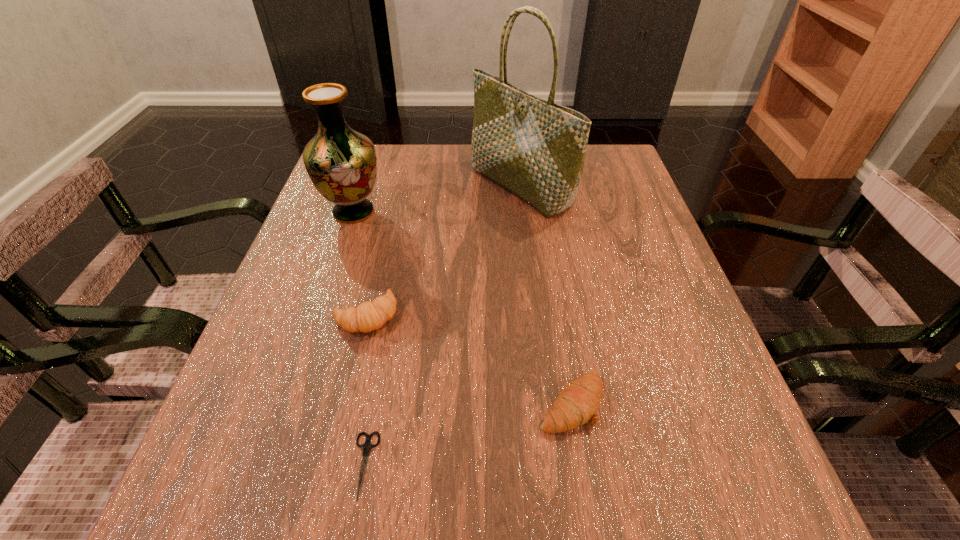
This screenshot has height=540, width=960. Identify the location of blank area at the left edge. (337, 329).

Identify the location of vacant space at the right edge of the desktop. click(605, 295).

You are a GUI agent. You are given a task and a screenshot of the screen. Output one action in this format:
    pyautogui.click(x=<x>, y=<y>)
    Task: Click on the blank area at the far right corner
    This screenshot has height=540, width=960.
    Given the screenshot: What is the action you would take?
    pyautogui.click(x=605, y=167)

Image resolution: width=960 pixels, height=540 pixels. I want to click on free spot at the near right corner of the desktop, so click(759, 477).

Where is `free spot between the shears and the farther crescent roll`? This screenshot has width=960, height=540. free spot between the shears and the farther crescent roll is located at coordinates (365, 390).

In order to click on vacant region between the fourth tallest object and the shortest object in this screenshot , I will do `click(468, 434)`.

Find the location of a particular element. This screenshot has width=960, height=540. unoccupied area between the fourth tallest object and the shears is located at coordinates (468, 434).

Identify the location of vacant point located between the shorter crescent roll and the second tallest object. The image size is (960, 540). (462, 308).

Where is `free spot between the farther crescent roll and the shopping bag`? free spot between the farther crescent roll and the shopping bag is located at coordinates (444, 251).

The width and height of the screenshot is (960, 540). Identify the location of free space between the shears and the fourth shortest object. (359, 339).